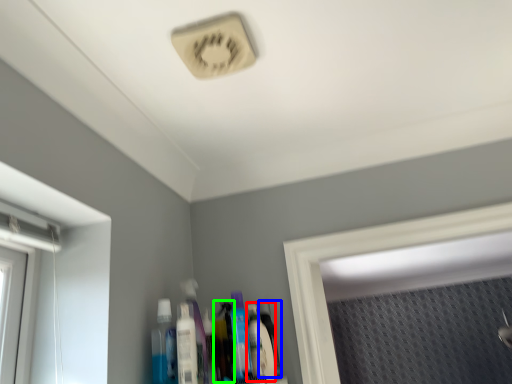
Question: Which object is the farthest from mouthwash (highlighted by a red box)? Choose among these: bottle (highlighted by a blue box) or toiletry (highlighted by a green box).

Choices:
 (A) bottle
 (B) toiletry

Answer: (A)